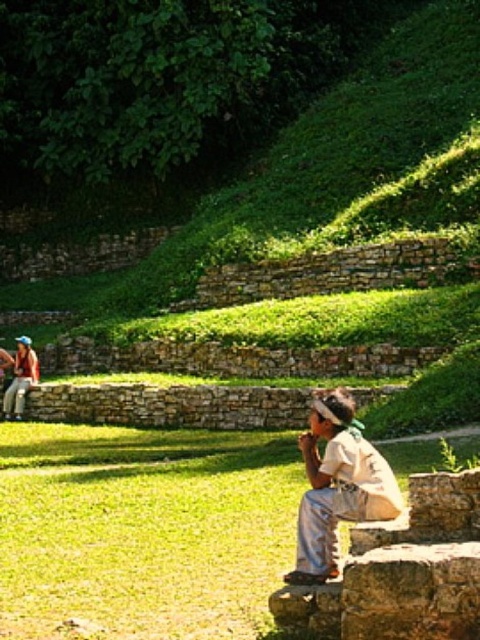
Question: Which point is closer to the camera?

Choices:
 (A) matte blue shirt at left
 (B) green grass at lower left

Answer: (B)

Question: Is khaki cotton shirt at center bigger than matte blue shirt at left?

Choices:
 (A) yes
 (B) no

Answer: (B)

Question: Among these points, which one is nearest to the camera?

Choices:
 (A) click(x=26, y=371)
 (B) click(x=394, y=508)

Answer: (B)

Question: Is green grass at lower left above matte blue shirt at left?

Choices:
 (A) no
 (B) yes

Answer: (A)

Question: Which point is farther from the camera taking this photo?

Choices:
 (A) (12, 621)
 (B) (310, 467)

Answer: (B)

Question: Can you confirm if green grass at lower left is thinner than matte blue shirt at left?

Choices:
 (A) no
 (B) yes

Answer: (A)